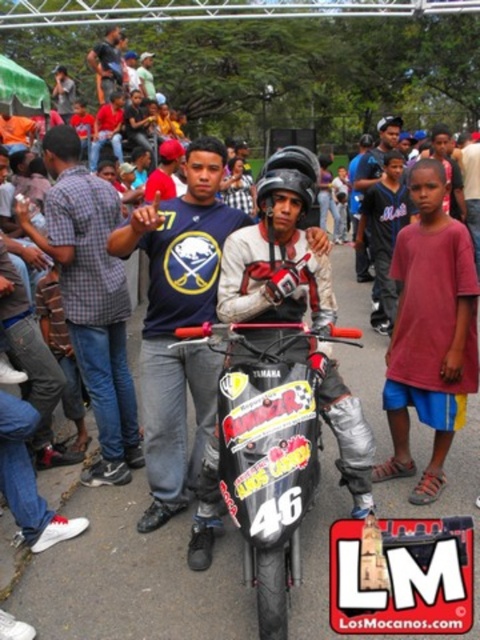
You are a photographer trying to capture a clear shot of the shiny metallic motorcycle at center and the black matte helmet at center. Since you want both objects in focus, you need to adjust your camera settings. Based on their positions, which object should you focus on to ensure both are sharp?

The shiny metallic motorcycle at center is below the black matte helmet at center. To ensure both are in focus, you should focus on the black matte helmet at center as it is closer to the camera, allowing the motorcycle below it to also be in focus within the depth of field.

You are a photographer standing in front of the shiny metallic motorcycle at center and the black matte helmet at center. You want to take a photo that focuses on the motorcycle while keeping the helmet in the background. Is the current arrangement suitable for this purpose?

Yes, the current arrangement is suitable because the shiny metallic motorcycle at center is closer to the viewer than the black matte helmet at center, allowing the motorcycle to be in focus while the helmet appears in the background.